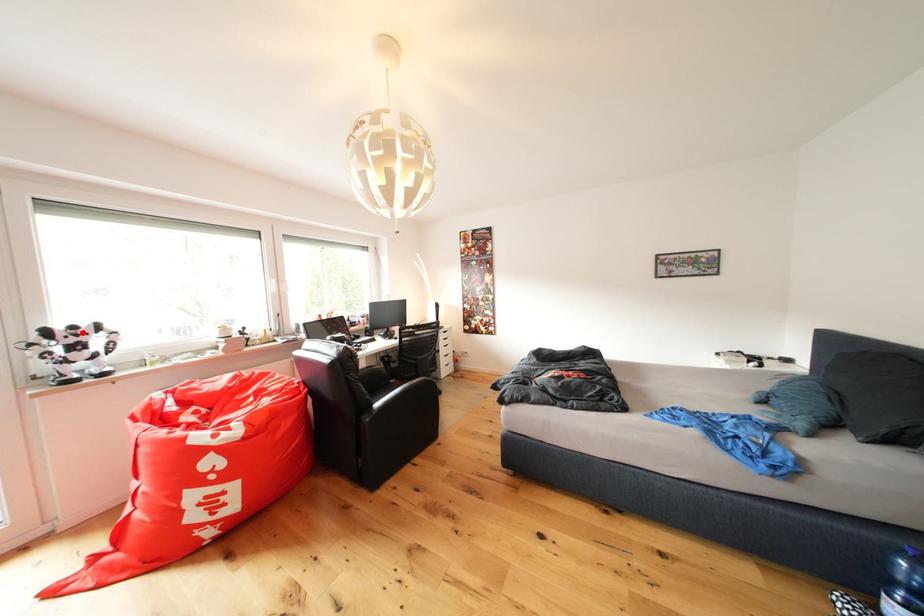
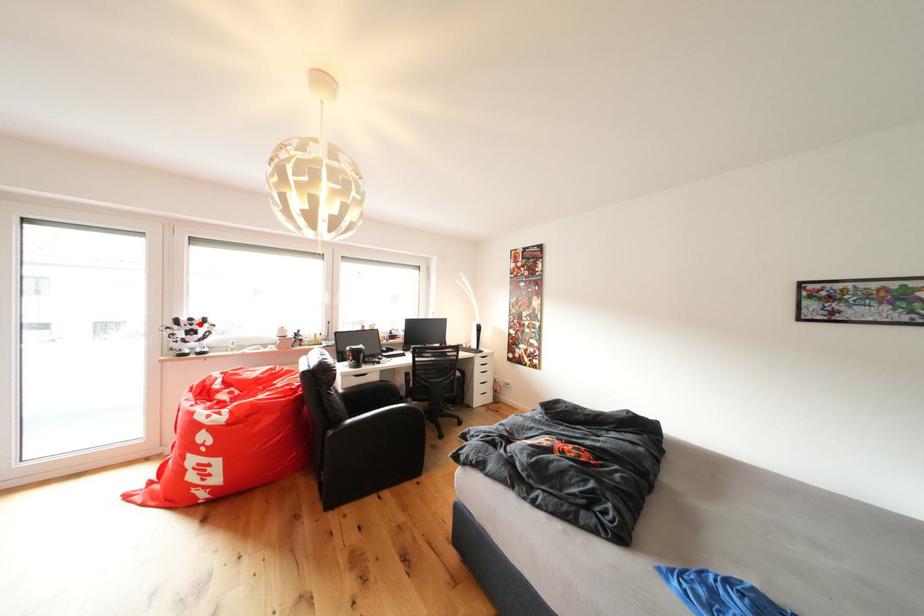
I am providing you with two images of the same scene from different viewpoints. A red point is marked on the first image and another point is marked on the second image. Does the point marked in image1 correspond to the same location as the one in image2?

Yes